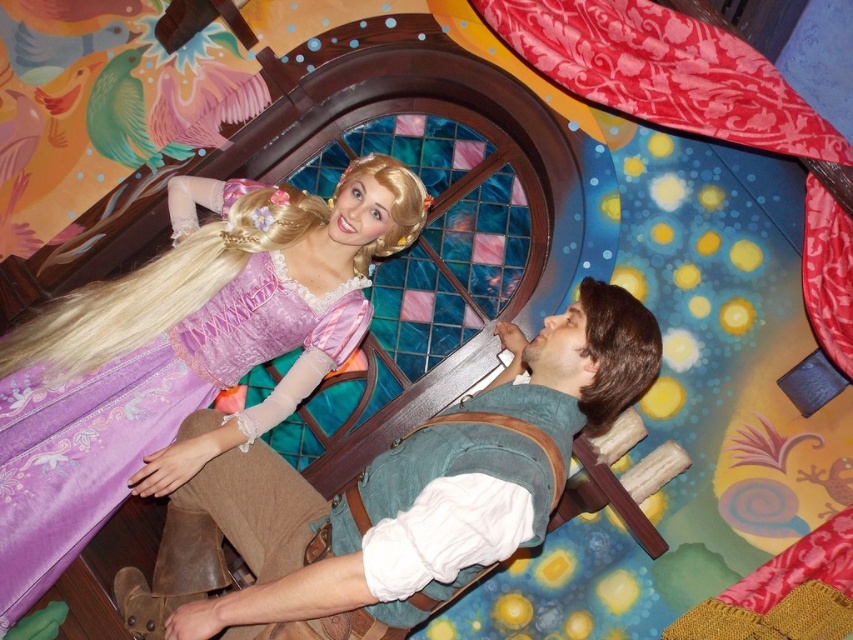
Consider the image. You are designing a stage for a fairy tale play and need to decide which costume will require more fabric. Based on the image, which of the two items, the purple satin dress at upper left or the red satin curtain at upper right, has a greater width?

The purple satin dress at upper left has a greater width than the red satin curtain at upper right according to the description.

You are a photographer standing at the camera position. You want to take a closeup shot of the matte green vest at center. Is the vest within your camera range if your camera can focus on objects between 10 to 15 feet away?

The matte green vest at center is 12.87 feet away from the camera, which falls within the focus range of 10 to 15 feet. Therefore, the camera can focus on the matte green vest at center for a closeup shot.